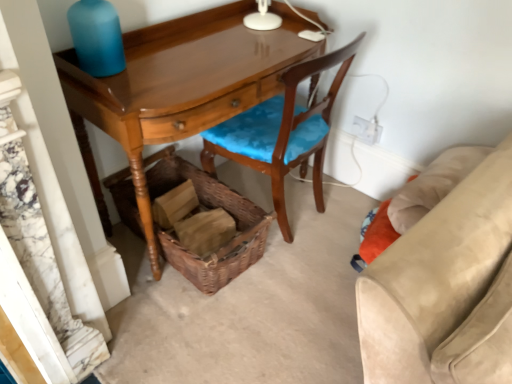
Identify the location of unoccupied area behind blue matte bottle at upper left. This screenshot has width=512, height=384. (143, 45).